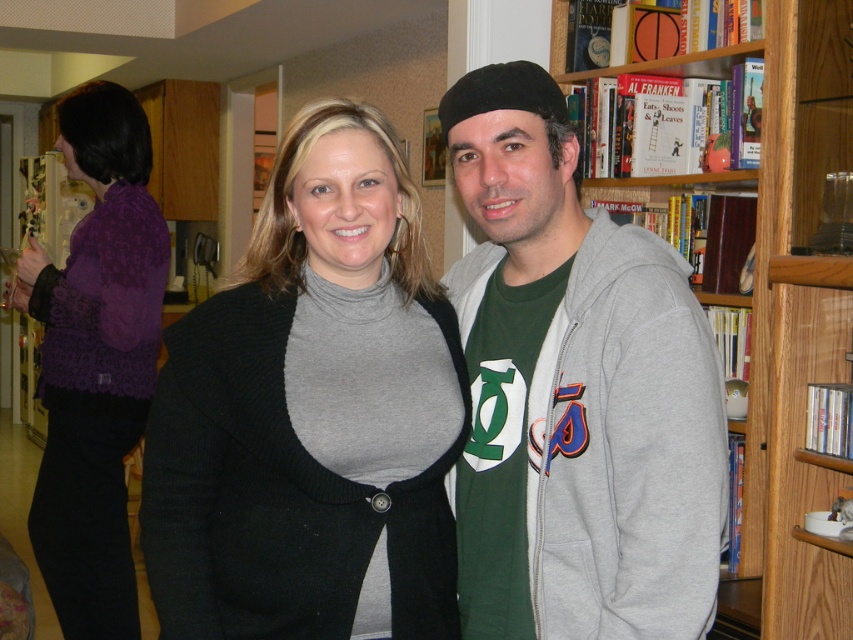
Which is below, green cotton t-shirt at center or wooden bookcase at right?

green cotton t-shirt at center is below.

Is green cotton t-shirt at center positioned in front of wooden bookcase at right?

Yes, it is in front of wooden bookcase at right.

Is point (567, 371) behind point (840, 36)?

No, it is not.

Where is `green cotton t-shirt at center`? The image size is (853, 640). green cotton t-shirt at center is located at coordinates (573, 392).

Is the position of knit gray turtleneck at center more distant than that of purple lace sweater at left?

No, knit gray turtleneck at center is in front of purple lace sweater at left.

What do you see at coordinates (312, 413) in the screenshot?
I see `knit gray turtleneck at center` at bounding box center [312, 413].

Identify the location of knit gray turtleneck at center. (312, 413).

Who is more forward, (367, 337) or (775, 13)?

Point (367, 337) is in front.

Can you confirm if knit gray turtleneck at center is wider than wooden bookcase at right?

No, knit gray turtleneck at center is not wider than wooden bookcase at right.

Find the location of a particular element. knit gray turtleneck at center is located at coordinates (312, 413).